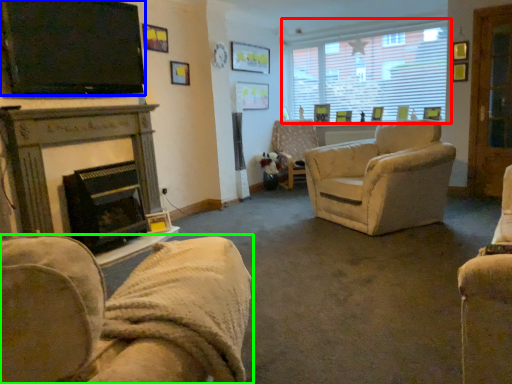
Question: Estimate the real-world distances between objects in this image. Which object is closer to window (highlighted by a red box), television (highlighted by a blue box) or chair (highlighted by a green box)?

Choices:
 (A) television
 (B) chair

Answer: (A)